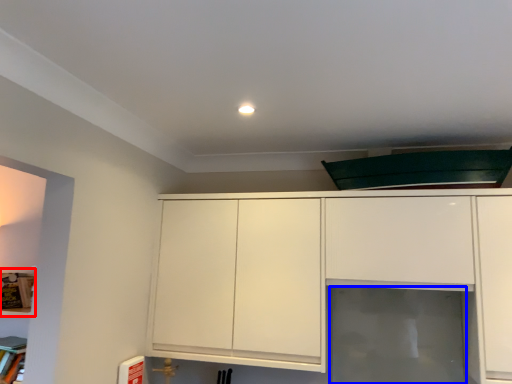
Question: Which object appears closest to the camera in this image, shelf (highlighted by a red box) or glass door (highlighted by a blue box)?

Choices:
 (A) shelf
 (B) glass door

Answer: (B)